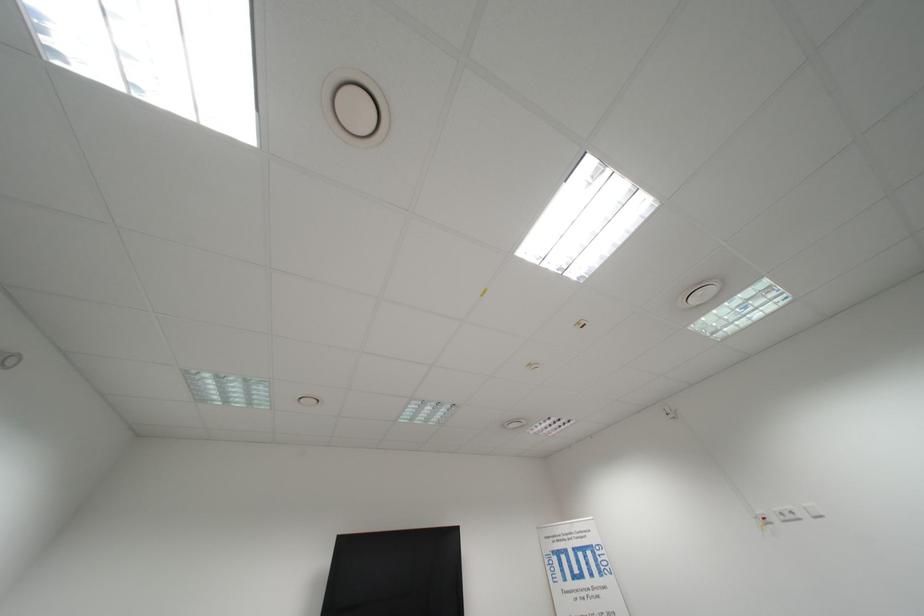
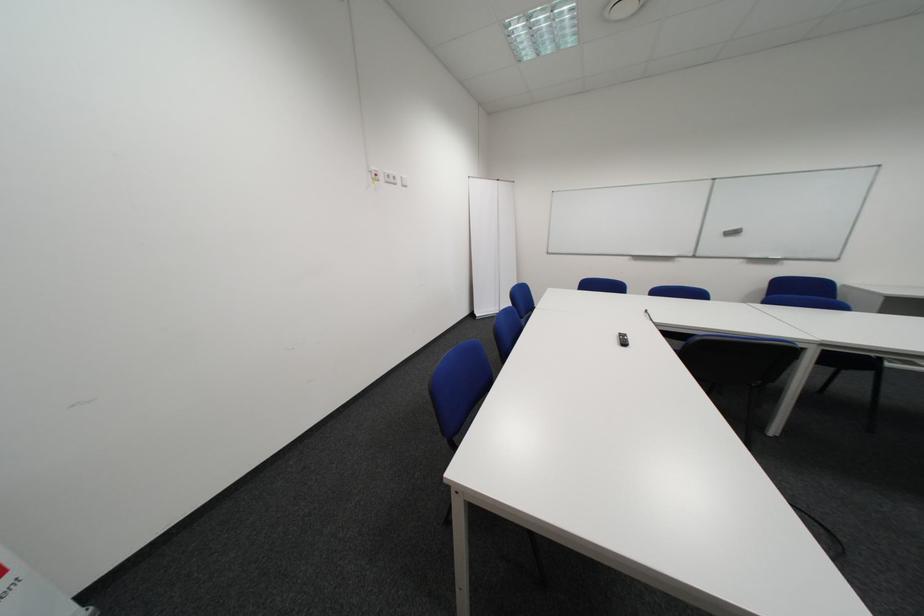
Where in the second image is the point corresponding to point 805,514 from the first image?

(407, 179)